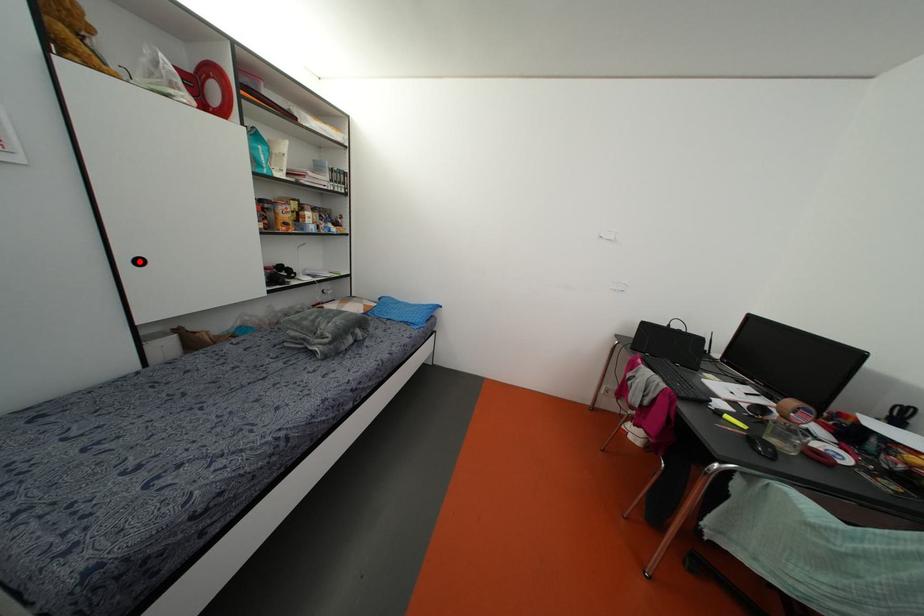
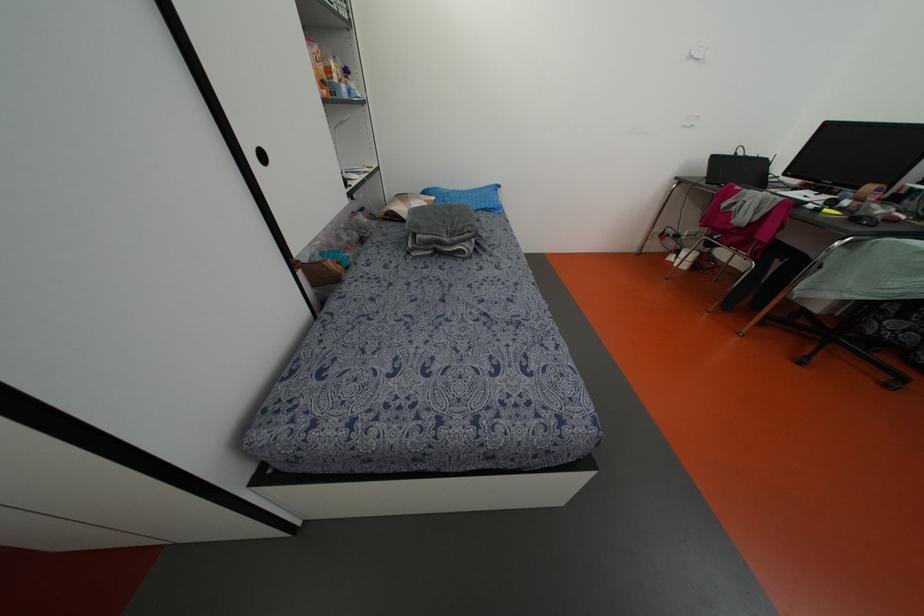
The point at the highlighted location is marked in the first image. Where is the corresponding point in the second image?

(262, 156)